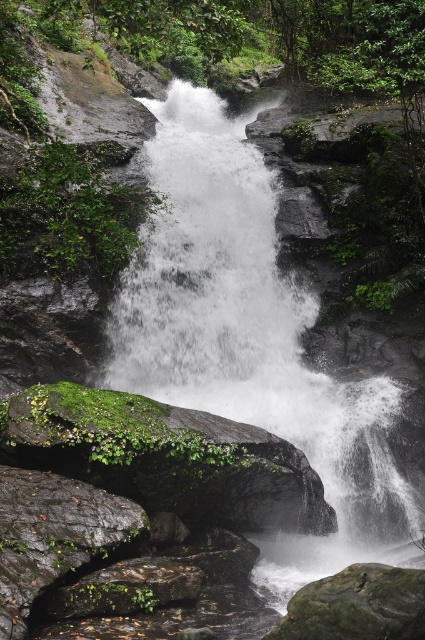
Can you confirm if white frothy water at center is positioned to the right of smooth gray rock at lower center?

Incorrect, white frothy water at center is not on the right side of smooth gray rock at lower center.

Image resolution: width=425 pixels, height=640 pixels. What do you see at coordinates (252, 340) in the screenshot? I see `white frothy water at center` at bounding box center [252, 340].

Where is `white frothy water at center`? This screenshot has width=425, height=640. white frothy water at center is located at coordinates (252, 340).